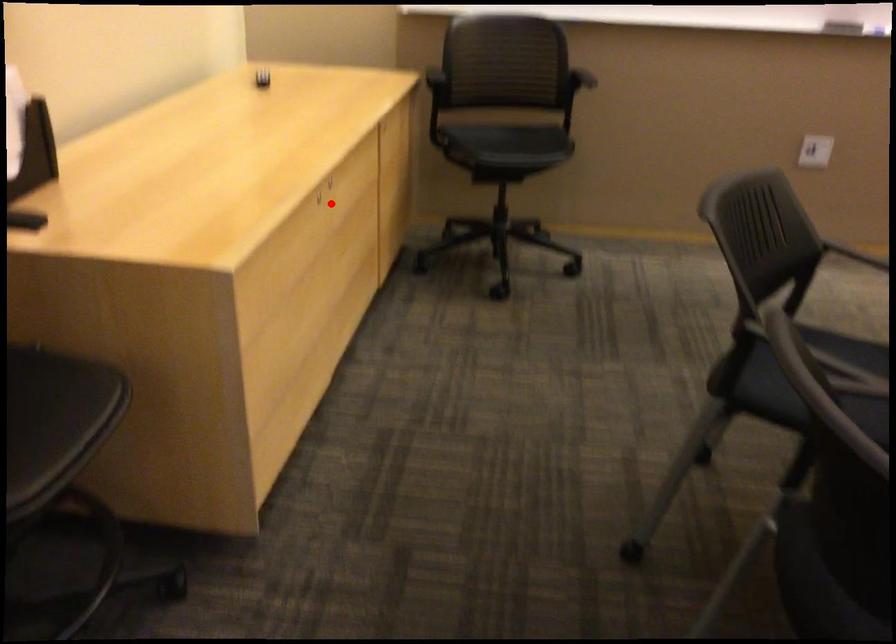
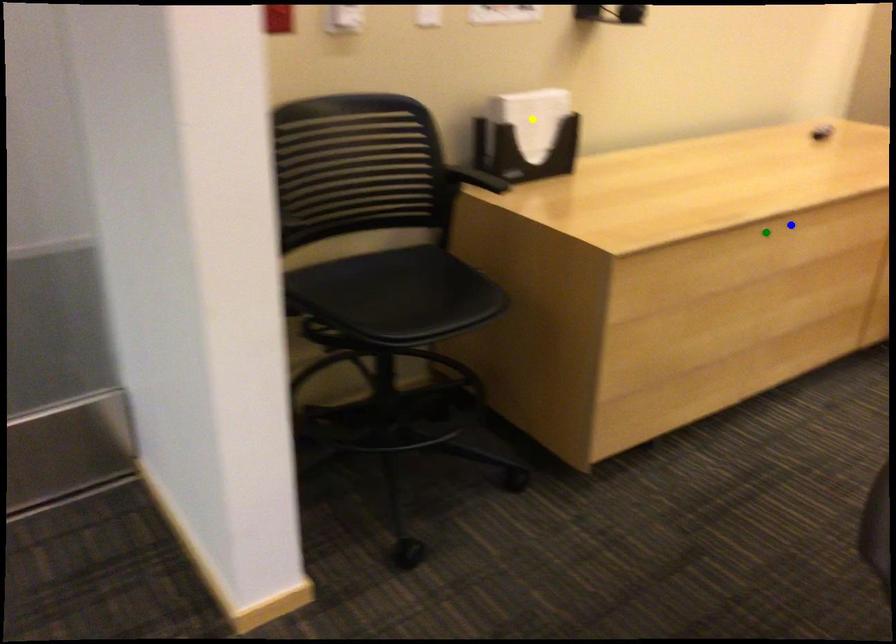
Question: I am providing you with two images of the same scene from different viewpoints. A red point is marked on the first image. You are given multiple points on the second image. Which point in image 2 is actually the same real-world point as the red point in image 1?

Choices:
 (A) yellow point
 (B) green point
 (C) blue point

Answer: (B)